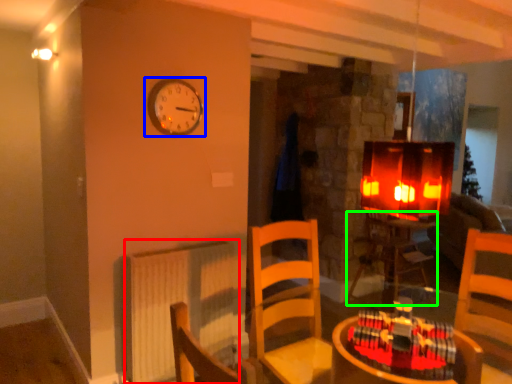
Question: Based on their relative distances, which object is farther from radiator (highlighted by a red box)? Choose from wall clock (highlighted by a blue box) and table (highlighted by a green box).

Choices:
 (A) wall clock
 (B) table

Answer: (B)